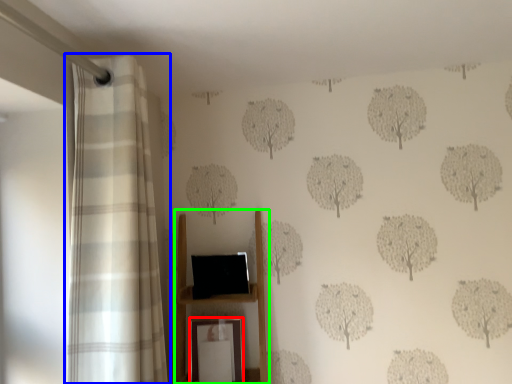
Question: Estimate the real-world distances between objects in this image. Which object is farther from picture frame (highlighted by a red box), curtain (highlighted by a blue box) or furniture (highlighted by a green box)?

Choices:
 (A) curtain
 (B) furniture

Answer: (A)